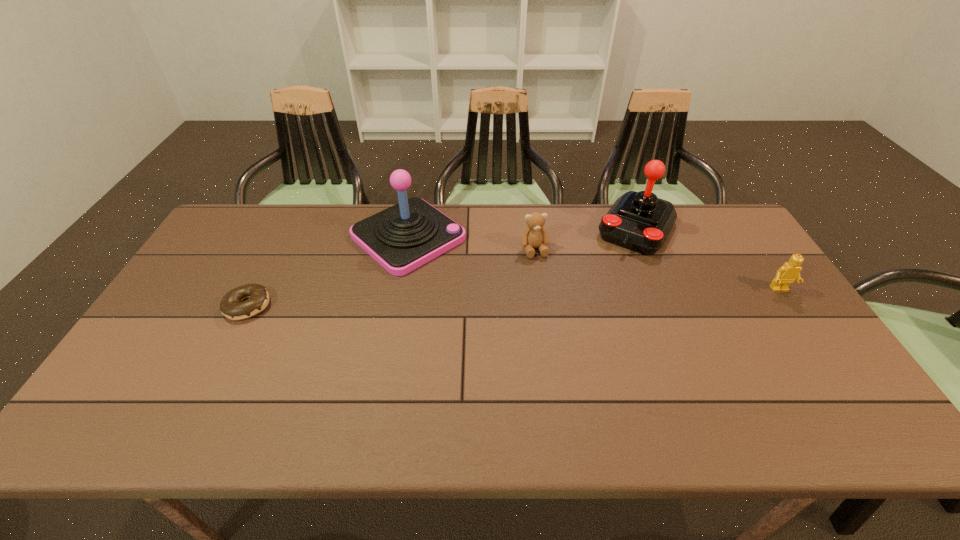
This screenshot has height=540, width=960. What are the coordinates of `free space on the desktop that is between the leftmost object and the Lego and is positioned on the face of the third object from right to left` in the screenshot? It's located at (550, 296).

Locate an element on the screen. This screenshot has height=540, width=960. vacant spot on the desktop that is between the leftmost object and the Lego and is positioned forward from the base of the second object from left to right is located at coordinates (487, 299).

You are a GUI agent. You are given a task and a screenshot of the screen. Output one action in this format:
    pyautogui.click(x=<x>, y=<y>)
    Task: Click on the free space on the desktop that is between the shortest object and the rightmost object and is positioned on the base of the right joystick
    This screenshot has width=960, height=540.
    Given the screenshot: What is the action you would take?
    pos(595,295)